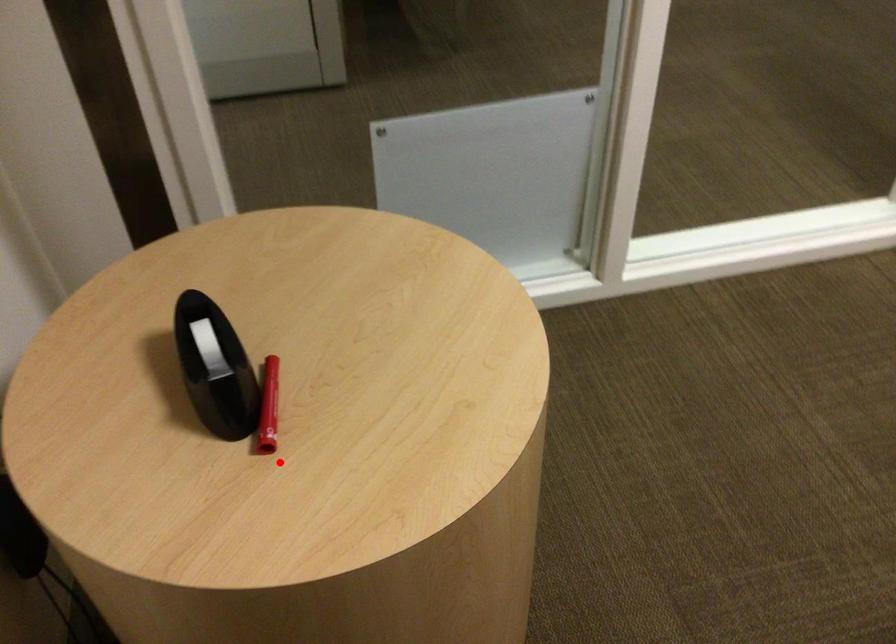
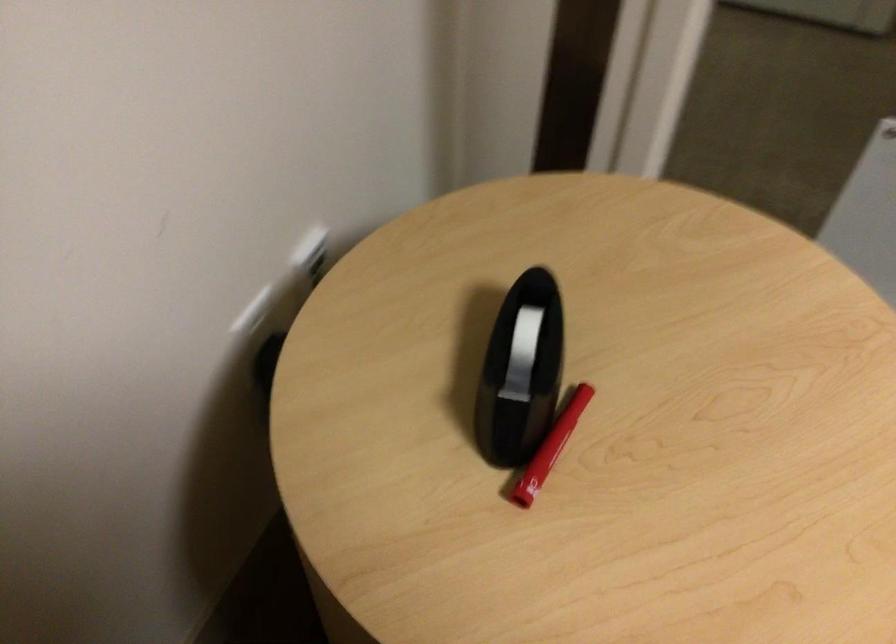
The point at the highlighted location is marked in the first image. Where is the corresponding point in the second image?

(527, 511)